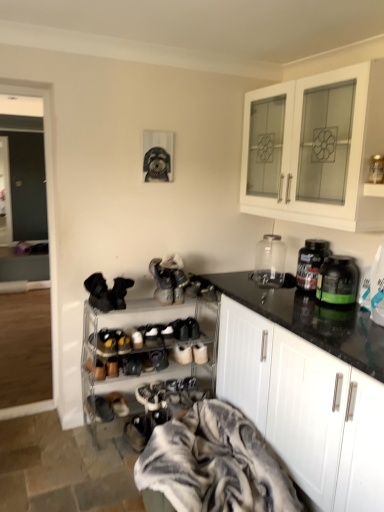
Find the location of a particular element. vacant region in front of green plastic jar at right, the second bottle from the back is located at coordinates (338, 314).